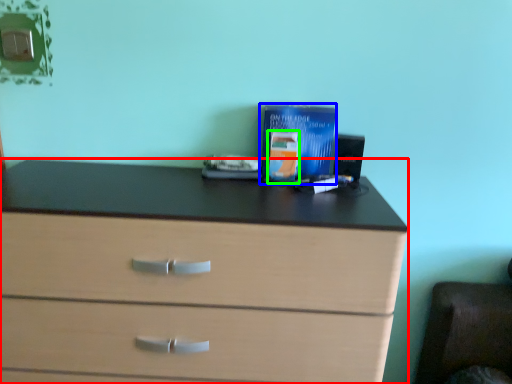
Question: Which object is positioned farthest from chest of drawers (highlighted by a red box)? Select from paperback book (highlighted by a blue box) and paperback book (highlighted by a green box).

Choices:
 (A) paperback book
 (B) paperback book

Answer: (B)